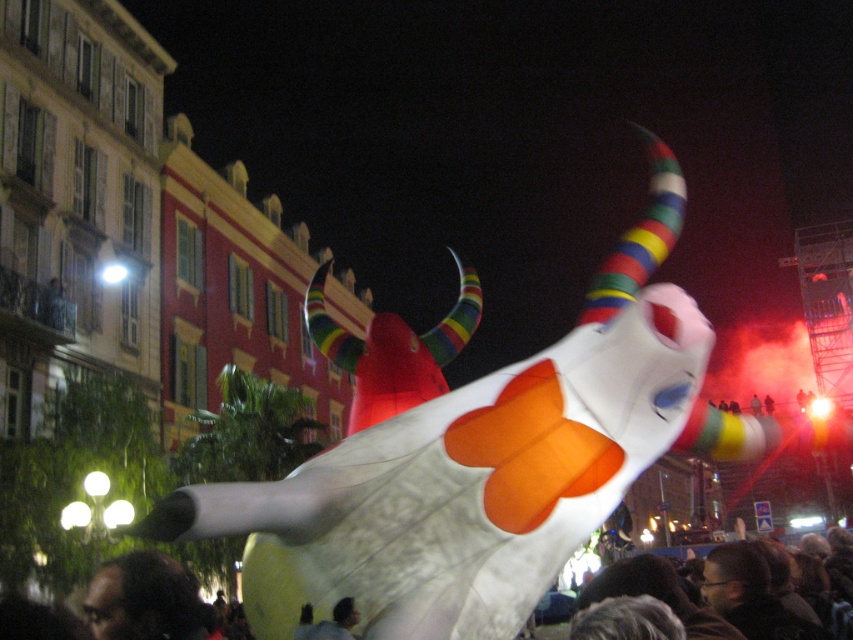
Question: Which point appears farthest from the camera in this image?

Choices:
 (A) (161, 561)
 (B) (598, 326)

Answer: (A)

Question: Which of the following is the closest to the observer?

Choices:
 (A) (683, 388)
 (B) (178, 604)

Answer: (A)

Question: Can you confirm if white fabric bull at center is positioned above dark hair at lower left?

Choices:
 (A) yes
 (B) no

Answer: (A)

Question: Considering the relative positions of white fabric bull at center and dark hair at lower left in the image provided, where is white fabric bull at center located with respect to dark hair at lower left?

Choices:
 (A) above
 (B) below

Answer: (A)

Question: Does white fabric bull at center appear on the left side of dark hair at lower left?

Choices:
 (A) yes
 (B) no

Answer: (B)